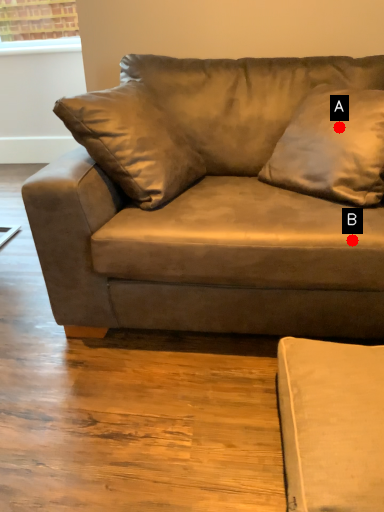
Question: Two points are circled on the image, labeled by A and B beside each circle. Which point is farther from the camera taking this photo?

Choices:
 (A) A is further
 (B) B is further

Answer: (A)